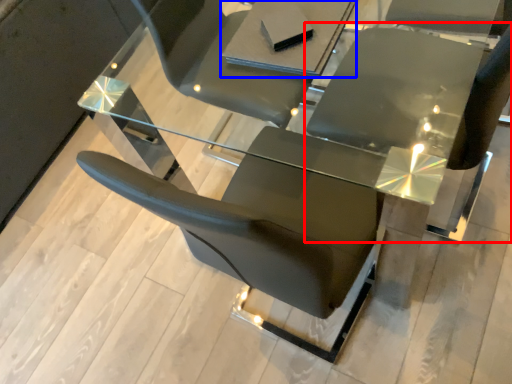
Question: Which object is closer to the camera taking this photo, chair (highlighted by a red box) or table (highlighted by a blue box)?

Choices:
 (A) chair
 (B) table

Answer: (A)